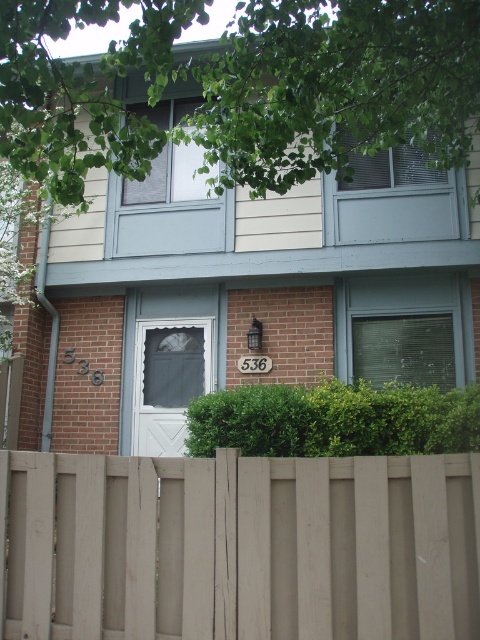
Who is taller, light brown wooden fence at lower center or white mesh screen door at center?

white mesh screen door at center

Can you confirm if light brown wooden fence at lower center is shorter than white mesh screen door at center?

Correct, light brown wooden fence at lower center is not as tall as white mesh screen door at center.

This screenshot has height=640, width=480. Describe the element at coordinates (240, 547) in the screenshot. I see `light brown wooden fence at lower center` at that location.

The height and width of the screenshot is (640, 480). I want to click on light brown wooden fence at lower center, so click(240, 547).

Is light brown wooden fence at lower center wider than green leafy hedge at center?

No, light brown wooden fence at lower center is not wider than green leafy hedge at center.

Looking at this image, can you confirm if light brown wooden fence at lower center is smaller than green leafy hedge at center?

Correct, light brown wooden fence at lower center occupies less space than green leafy hedge at center.

Which is behind, point (384, 481) or point (460, 445)?

Positioned behind is point (460, 445).

Find the location of `light brown wooden fence at lower center`. light brown wooden fence at lower center is located at coordinates (240, 547).

In the scene shown: Is green leafy hedge at center to the right of white mesh screen door at center from the viewer's perspective?

Correct, you'll find green leafy hedge at center to the right of white mesh screen door at center.

Which is above, green leafy hedge at center or white mesh screen door at center?

Positioned higher is white mesh screen door at center.

At what (x,y) coordinates should I click in order to perform the action: click on green leafy hedge at center. Please return your answer as a coordinate pair (x, y). Looking at the image, I should click on (335, 419).

Where is `green leafy hedge at center`? green leafy hedge at center is located at coordinates (335, 419).